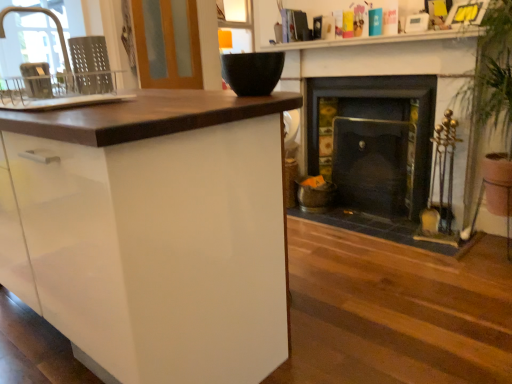
What do you see at coordinates (158, 231) in the screenshot? This screenshot has width=512, height=384. I see `white glossy cabinet at left` at bounding box center [158, 231].

Locate an element on the screen. This screenshot has width=512, height=384. white glossy cabinet at left is located at coordinates [158, 231].

This screenshot has width=512, height=384. Describe the element at coordinates (376, 141) in the screenshot. I see `dark brown wood fireplace at center, which is counted as the 2th fireplace, starting from the left` at that location.

Locate an element on the screen. dark gray stone fireplace at right, placed as the 2th fireplace when sorted from right to left is located at coordinates (378, 119).

What do you see at coordinates (380, 39) in the screenshot?
I see `matte black bowl at upper center` at bounding box center [380, 39].

The width and height of the screenshot is (512, 384). I want to click on matte black bowl at upper center, so click(380, 39).

What are the coordinates of `white glossy cabinet at left` in the screenshot? It's located at (158, 231).

Does matte black bowl at upper center touch wooden screen door at upper left?

No, matte black bowl at upper center is not beside wooden screen door at upper left.

Considering the sizes of matte black bowl at upper center and wooden screen door at upper left in the image, is matte black bowl at upper center taller or shorter than wooden screen door at upper left?

Considering their sizes, matte black bowl at upper center has less height than wooden screen door at upper left.

From a real-world perspective, between matte black bowl at upper center and wooden screen door at upper left, who is vertically lower?

matte black bowl at upper center.

Consider the image. In terms of width, does black matte bowl at upper center, the first appliance in the right-to-left sequence, look wider or thinner when compared to white glossy cabinet at left?

Considering their sizes, black matte bowl at upper center, the first appliance in the right-to-left sequence, looks slimmer than white glossy cabinet at left.

Can you confirm if black matte bowl at upper center, the first appliance in the right-to-left sequence, is taller than white glossy cabinet at left?

No.

Which is in front, point (255, 61) or point (92, 208)?

Positioned in front is point (92, 208).

From a real-world perspective, which appliance is the 1st one above the white glossy cabinet at left? Please provide its 2D coordinates.

[(252, 72)]

Between black matte bowl at upper center, the first appliance in the right-to-left sequence, and matte silver faucet at left, which one has smaller width?

With smaller width is black matte bowl at upper center, the first appliance in the right-to-left sequence.

Is black matte bowl at upper center, the first appliance in the right-to-left sequence, not inside matte silver faucet at left?

Yes.

Is black matte bowl at upper center, which is the 2th appliance from left to right, in front of or behind matte silver faucet at left in the image?

Visually, black matte bowl at upper center, which is the 2th appliance from left to right, is located in front of matte silver faucet at left.

Is point (91, 84) positioned before point (418, 36)?

Yes, point (91, 84) is in front of point (418, 36).

Considering the sizes of white glossy sink at left and matte black bowl at upper center in the image, is white glossy sink at left taller or shorter than matte black bowl at upper center?

white glossy sink at left is taller than matte black bowl at upper center.

Measure the distance from white glossy sink at left to matte black bowl at upper center.

They are 1.88 meters apart.

Considering the positions of objects white glossy sink at left and matte black bowl at upper center in the image provided, who is more to the right, white glossy sink at left or matte black bowl at upper center?

From the viewer's perspective, matte black bowl at upper center appears more on the right side.

Is white glossy cabinet at left oriented towards dark brown wood fireplace at center, which ranks as the first fireplace in right-to-left order?

Yes.

Is white glossy cabinet at left not near dark brown wood fireplace at center, which is counted as the 2th fireplace, starting from the left?

Yes, white glossy cabinet at left is far from dark brown wood fireplace at center, which is counted as the 2th fireplace, starting from the left.

Considering the sizes of objects white glossy cabinet at left and dark brown wood fireplace at center, which ranks as the first fireplace in right-to-left order, in the image provided, who is smaller, white glossy cabinet at left or dark brown wood fireplace at center, which ranks as the first fireplace in right-to-left order,?

With smaller size is dark brown wood fireplace at center, which ranks as the first fireplace in right-to-left order.

Which of these two, white glossy cabinet at left or dark brown wood fireplace at center, which ranks as the first fireplace in right-to-left order, stands shorter?

dark brown wood fireplace at center, which ranks as the first fireplace in right-to-left order.

From a real-world perspective, is matte silver faucet at left located beneath metallic gray dish rack at left, the 1th appliance from the left?

No.

Between matte silver faucet at left and metallic gray dish rack at left, the second appliance positioned from the right, which one has less height?

With less height is metallic gray dish rack at left, the second appliance positioned from the right.

Is there a large distance between matte silver faucet at left and metallic gray dish rack at left, the 1th appliance from the left?

Indeed, matte silver faucet at left is not near metallic gray dish rack at left, the 1th appliance from the left.

Would you say matte silver faucet at left is inside or outside metallic gray dish rack at left, the 1th appliance from the left?

matte silver faucet at left is spatially situated outside metallic gray dish rack at left, the 1th appliance from the left.

Is dark brown wood fireplace at center, which ranks as the first fireplace in right-to-left order, next to matte silver faucet at left?

No, dark brown wood fireplace at center, which ranks as the first fireplace in right-to-left order, is not with matte silver faucet at left.

Considering the positions of points (369, 176) and (63, 52), is point (369, 176) closer to camera compared to point (63, 52)?

No, it is behind (63, 52).

In the scene shown: Is dark brown wood fireplace at center, which is counted as the 2th fireplace, starting from the left, behind matte silver faucet at left?

Yes, dark brown wood fireplace at center, which is counted as the 2th fireplace, starting from the left, is further from the viewer.

Which object is positioned more to the left, dark brown wood fireplace at center, which is counted as the 2th fireplace, starting from the left, or matte silver faucet at left?

Positioned to the left is matte silver faucet at left.

At what (x,y) coordinates should I click in order to perform the action: click on counter top in front of the wooden screen door at upper left. Please return your answer as a coordinate pair (x, y). The height and width of the screenshot is (384, 512). Looking at the image, I should click on (380, 39).

Image resolution: width=512 pixels, height=384 pixels. In order to click on cabinetry on the left of black matte bowl at upper center, the first appliance in the right-to-left sequence in this screenshot , I will do `click(158, 231)`.

Considering their positions, is dark brown wood fireplace at center, which ranks as the first fireplace in right-to-left order, positioned closer to white glossy sink at left than black matte bowl at upper center, which is the 2th appliance from left to right?

Among the two, black matte bowl at upper center, which is the 2th appliance from left to right, is located nearer to white glossy sink at left.

Which object lies nearer to the anchor point black matte bowl at upper center, which is the 2th appliance from left to right, white glossy sink at left or matte silver faucet at left?

Among the two, white glossy sink at left is located nearer to black matte bowl at upper center, which is the 2th appliance from left to right.

Looking at the image, which one is located further to black matte bowl at upper center, which is the 2th appliance from left to right, metallic gray dish rack at left, the second appliance positioned from the right, or dark brown wood fireplace at center, which ranks as the first fireplace in right-to-left order?

Based on the image, dark brown wood fireplace at center, which ranks as the first fireplace in right-to-left order, appears to be further to black matte bowl at upper center, which is the 2th appliance from left to right.

From the image, which object appears to be farther from metallic gray dish rack at left, the second appliance positioned from the right, dark brown wood fireplace at center, which is counted as the 2th fireplace, starting from the left, or black matte bowl at upper center, which is the 2th appliance from left to right?

dark brown wood fireplace at center, which is counted as the 2th fireplace, starting from the left, lies further to metallic gray dish rack at left, the second appliance positioned from the right, than the other object.

Estimate the real-world distances between objects in this image. Which object is closer to matte black bowl at upper center, white glossy cabinet at left or matte silver faucet at left?

white glossy cabinet at left.

Looking at the image, which one is located closer to metallic gray dish rack at left, the second appliance positioned from the right, black matte bowl at upper center, the first appliance in the right-to-left sequence, or matte black bowl at upper center?

black matte bowl at upper center, the first appliance in the right-to-left sequence, is positioned closer to the anchor metallic gray dish rack at left, the second appliance positioned from the right.

Considering their positions, is white glossy sink at left positioned further to metallic gray dish rack at left, the second appliance positioned from the right, than matte silver faucet at left?

matte silver faucet at left is positioned further to the anchor metallic gray dish rack at left, the second appliance positioned from the right.

From the image, which object appears to be nearer to matte silver faucet at left, black matte bowl at upper center, the first appliance in the right-to-left sequence, or matte black bowl at upper center?

matte black bowl at upper center is positioned closer to the anchor matte silver faucet at left.

What are the coordinates of `appliance between matte silver faucet at left and black matte bowl at upper center, which is the 2th appliance from left to right, from left to right` in the screenshot? It's located at (37, 79).

Image resolution: width=512 pixels, height=384 pixels. In order to click on cabinetry situated between metallic gray dish rack at left, the second appliance positioned from the right, and black matte bowl at upper center, the first appliance in the right-to-left sequence, from left to right in this screenshot , I will do `click(158, 231)`.

You are a GUI agent. You are given a task and a screenshot of the screen. Output one action in this format:
    pyautogui.click(x=<x>, y=<y>)
    Task: Click on the appliance between white glossy cabinet at left and matte black bowl at upper center
    The width and height of the screenshot is (512, 384).
    Given the screenshot: What is the action you would take?
    pyautogui.click(x=252, y=72)

You are a GUI agent. You are given a task and a screenshot of the screen. Output one action in this format:
    pyautogui.click(x=<x>, y=<y>)
    Task: Click on the appliance between white glossy sink at left and dark gray stone fireplace at right, placed as the 2th fireplace when sorted from right to left, from left to right
    This screenshot has width=512, height=384.
    Given the screenshot: What is the action you would take?
    pyautogui.click(x=252, y=72)